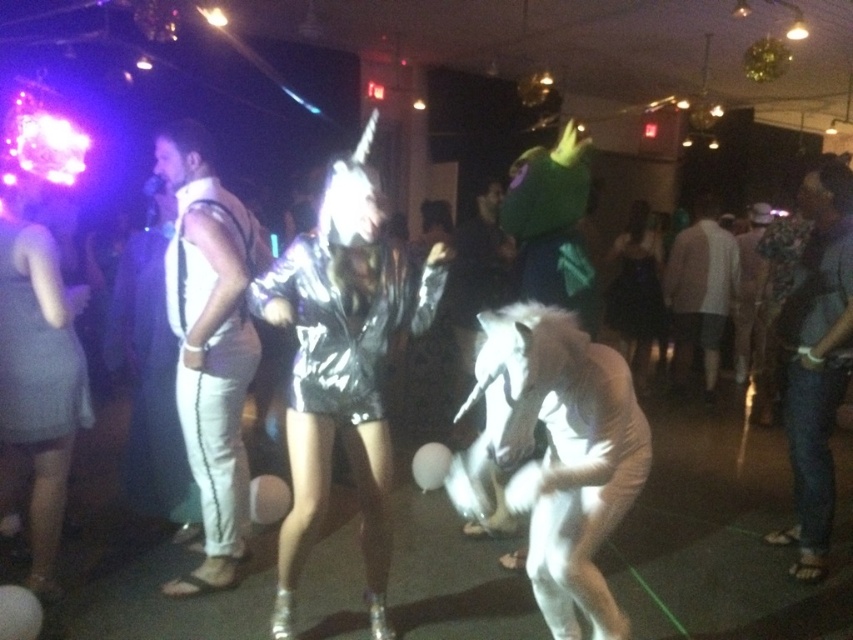
Question: Considering the relative positions of denim jeans at right and matte gray dress at left in the image provided, where is denim jeans at right located with respect to matte gray dress at left?

Choices:
 (A) right
 (B) left

Answer: (A)

Question: Among these objects, which one is nearest to the camera?

Choices:
 (A) black satin dress at center
 (B) denim jeans at right

Answer: (B)

Question: Estimate the real-world distances between objects in this image. Which object is farther from the black satin dress at center?

Choices:
 (A) matte gray dress at left
 (B) denim jeans at right

Answer: (A)

Question: Is matte gray dress at left behind white furry costume at center?

Choices:
 (A) yes
 (B) no

Answer: (B)

Question: Does denim jeans at right have a lesser width compared to black satin dress at center?

Choices:
 (A) yes
 (B) no

Answer: (A)

Question: Estimate the real-world distances between objects in this image. Which object is farther from the black satin dress at center?

Choices:
 (A) white matte pants at left
 (B) matte gray dress at left

Answer: (B)